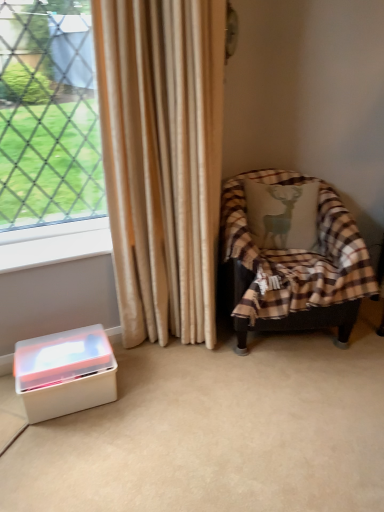
Question: From a real-world perspective, is plaid fabric chair at right under white plastic container at lower left?

Choices:
 (A) no
 (B) yes

Answer: (A)

Question: Does plaid fabric chair at right have a larger size compared to white plastic container at lower left?

Choices:
 (A) yes
 (B) no

Answer: (A)

Question: Is plaid fabric chair at right facing away from white plastic container at lower left?

Choices:
 (A) no
 (B) yes

Answer: (A)

Question: Is plaid fabric chair at right at the right side of white plastic container at lower left?

Choices:
 (A) no
 (B) yes

Answer: (B)

Question: Is plaid fabric chair at right aimed at white plastic container at lower left?

Choices:
 (A) yes
 (B) no

Answer: (B)

Question: Is plaid fabric chair at right situated inside white plastic container at lower left or outside?

Choices:
 (A) outside
 (B) inside

Answer: (A)

Question: Considering the positions of plaid fabric chair at right and white plastic container at lower left in the image, is plaid fabric chair at right wider or thinner than white plastic container at lower left?

Choices:
 (A) thin
 (B) wide

Answer: (B)

Question: Based on their sizes in the image, would you say plaid fabric chair at right is bigger or smaller than white plastic container at lower left?

Choices:
 (A) small
 (B) big

Answer: (B)

Question: Is plaid fabric chair at right taller or shorter than white plastic container at lower left?

Choices:
 (A) tall
 (B) short

Answer: (A)

Question: Is white plastic at lower left wider or thinner than plaid fabric chair at right?

Choices:
 (A) wide
 (B) thin

Answer: (B)

Question: From the image's perspective, is white plastic at lower left located above or below plaid fabric chair at right?

Choices:
 (A) above
 (B) below

Answer: (A)

Question: Does point pyautogui.click(x=9, y=265) appear closer or farther from the camera than point pyautogui.click(x=299, y=199)?

Choices:
 (A) closer
 (B) farther

Answer: (A)

Question: Looking at the image, does white plastic at lower left seem bigger or smaller compared to plaid fabric chair at right?

Choices:
 (A) big
 (B) small

Answer: (B)

Question: Is point (288, 273) positioned closer to the camera than point (57, 260)?

Choices:
 (A) farther
 (B) closer

Answer: (A)

Question: From a real-world perspective, relative to white plastic at lower left, is plaid fabric chair at right vertically above or below?

Choices:
 (A) above
 (B) below

Answer: (B)